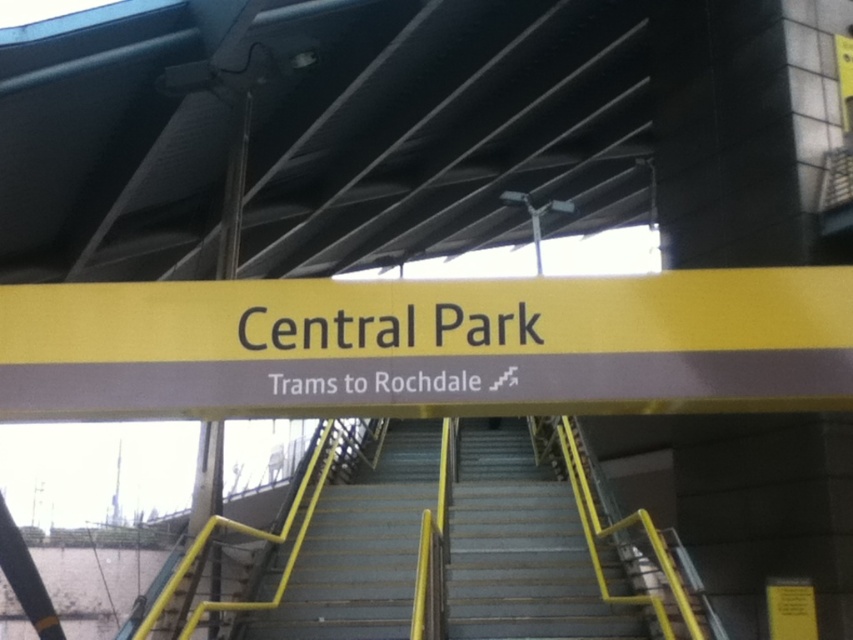
Which of these two, gray concrete stairs at center or metallic gray stairs at center, stands taller?

With more height is metallic gray stairs at center.

Who is positioned more to the left, gray concrete stairs at center or metallic gray stairs at center?

metallic gray stairs at center

Does point (518, 614) come farther from viewer compared to point (296, 608)?

No, it is in front of (296, 608).

Locate an element on the screen. Image resolution: width=853 pixels, height=640 pixels. gray concrete stairs at center is located at coordinates (520, 547).